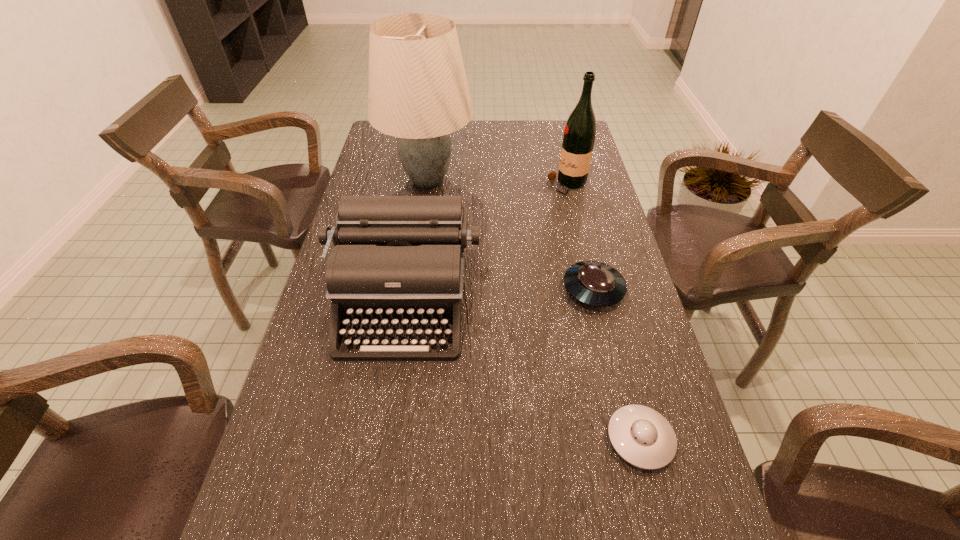
This screenshot has height=540, width=960. I want to click on the tallest object, so click(418, 92).

Where is `wine bottle`? wine bottle is located at coordinates (579, 135).

This screenshot has width=960, height=540. In order to click on the third tallest object in this screenshot , I will do `click(397, 261)`.

Locate an element on the screen. This screenshot has width=960, height=540. the taller saucer is located at coordinates (593, 283).

What are the coordinates of `the farther saucer` in the screenshot? It's located at (593, 283).

Find the location of a particular element. The width and height of the screenshot is (960, 540). the shorter saucer is located at coordinates (640, 435).

Find the location of a particular element. This screenshot has width=960, height=540. the nearest object is located at coordinates (640, 435).

I want to click on free spot located 0.280m on the right of the tallest object, so click(x=558, y=179).

Locate an element on the screen. free region located on the front of the wine bottle is located at coordinates (575, 215).

You are a GUI agent. You are given a task and a screenshot of the screen. Output one action in this format:
    pyautogui.click(x=<x>, y=<y>)
    Task: Click on the vacant point located on the typing side of the typewriter
    This screenshot has height=540, width=960.
    Given the screenshot: What is the action you would take?
    pyautogui.click(x=374, y=488)